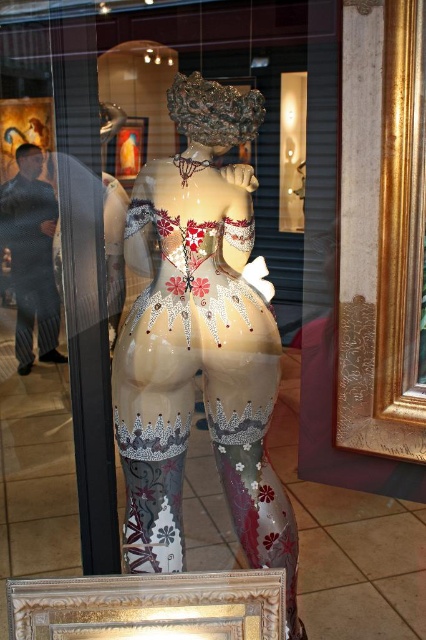
Question: Does glossy ceramic statue at center have a smaller size compared to gold ornate frame at lower center?

Choices:
 (A) no
 (B) yes

Answer: (A)

Question: Among these objects, which one is farthest from the camera?

Choices:
 (A) gold ornate frame at lower center
 (B) glossy ceramic statue at center
 (C) gold metallic picture frame at upper center

Answer: (C)

Question: Estimate the real-world distances between objects in this image. Which object is farther from the glossy ceramic statue at center?

Choices:
 (A) gold metallic picture frame at upper center
 (B) gold ornate frame at lower center

Answer: (A)

Question: In this image, where is glossy ceramic statue at center located relative to gold ornate frame at lower center?

Choices:
 (A) right
 (B) left

Answer: (A)

Question: Which of the following is the closest to the observer?

Choices:
 (A) (140, 468)
 (B) (63, 592)
 (C) (129, 157)

Answer: (B)

Question: Does gold ornate frame at lower center come in front of gold metallic picture frame at upper center?

Choices:
 (A) yes
 (B) no

Answer: (A)